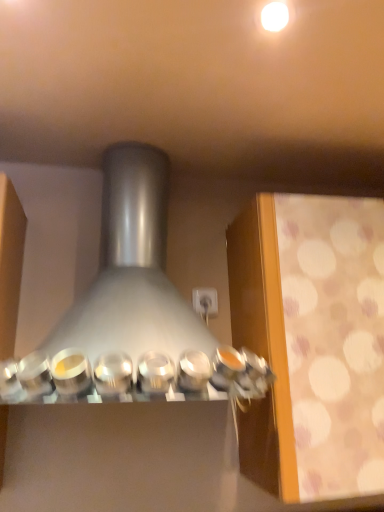
Question: Is white glossy light bulb at upper center far from satin silver range hood at center?

Choices:
 (A) yes
 (B) no

Answer: (B)

Question: Is white glossy light bulb at upper center wider than satin silver range hood at center?

Choices:
 (A) no
 (B) yes

Answer: (A)

Question: Considering the relative sizes of white glossy light bulb at upper center and satin silver range hood at center in the image provided, is white glossy light bulb at upper center smaller than satin silver range hood at center?

Choices:
 (A) yes
 (B) no

Answer: (A)

Question: Is white glossy light bulb at upper center completely or partially outside of satin silver range hood at center?

Choices:
 (A) no
 (B) yes

Answer: (B)

Question: Can you confirm if white glossy light bulb at upper center is bigger than satin silver range hood at center?

Choices:
 (A) no
 (B) yes

Answer: (A)

Question: Can you confirm if white glossy light bulb at upper center is taller than satin silver range hood at center?

Choices:
 (A) yes
 (B) no

Answer: (B)

Question: Is the position of satin silver range hood at center more distant than that of white glossy light bulb at upper center?

Choices:
 (A) no
 (B) yes

Answer: (A)

Question: Is satin silver range hood at center outside of white glossy light bulb at upper center?

Choices:
 (A) no
 (B) yes

Answer: (B)

Question: Is satin silver range hood at center positioned with its back to white glossy light bulb at upper center?

Choices:
 (A) no
 (B) yes

Answer: (A)

Question: Considering the relative sizes of satin silver range hood at center and white glossy light bulb at upper center in the image provided, is satin silver range hood at center wider than white glossy light bulb at upper center?

Choices:
 (A) no
 (B) yes

Answer: (B)

Question: Does satin silver range hood at center have a smaller size compared to white glossy light bulb at upper center?

Choices:
 (A) no
 (B) yes

Answer: (A)

Question: Would you say satin silver range hood at center contains white glossy light bulb at upper center?

Choices:
 (A) yes
 (B) no

Answer: (B)

Question: From a real-world perspective, is white glossy light bulb at upper center physically located above or below satin silver range hood at center?

Choices:
 (A) below
 (B) above

Answer: (B)